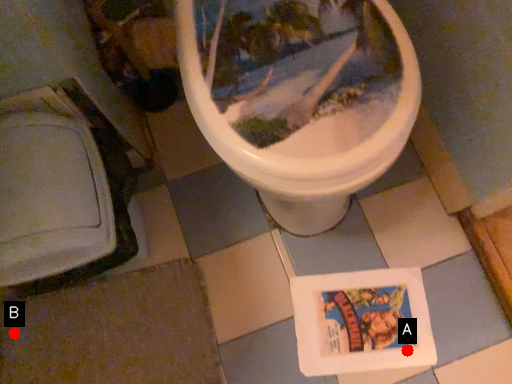
Question: Two points are circled on the image, labeled by A and B beside each circle. Which of the following is the farthest from the observer?

Choices:
 (A) A is further
 (B) B is further

Answer: (B)